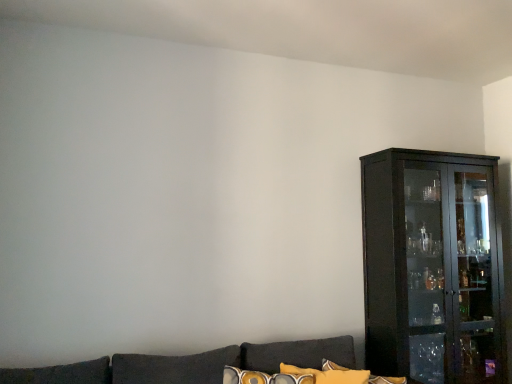
Measure the distance between yellow fabric pillow at lower center and camera.

yellow fabric pillow at lower center is 7.14 feet away from camera.

This screenshot has width=512, height=384. I want to click on yellow fabric pillow at lower center, so click(298, 354).

In order to face yellow fabric pillow at lower center, should I rotate leftwards or rightwards?

To align with it, rotate right about 8.423°.

What is the approximate width of yellow fabric pillow at lower center?

13.98 inches.

Describe the element at coordinates (298, 354) in the screenshot. This screenshot has height=384, width=512. I see `yellow fabric pillow at lower center` at that location.

Identify the location of yellow fabric pillow at lower center. This screenshot has height=384, width=512. (298, 354).